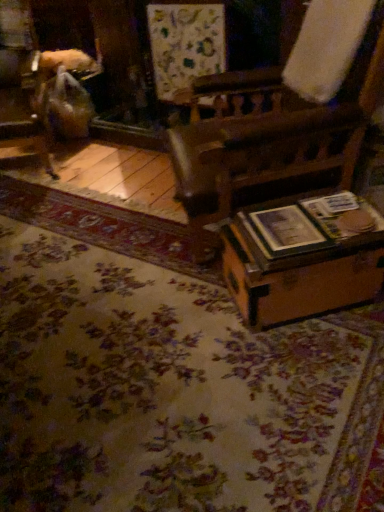
Where is `floral carpet at center`? This screenshot has width=384, height=512. floral carpet at center is located at coordinates (166, 376).

The height and width of the screenshot is (512, 384). What do you see at coordinates (303, 257) in the screenshot?
I see `wooden trunk at lower right` at bounding box center [303, 257].

Locate an element on the screen. This screenshot has height=512, width=384. floral carpet at center is located at coordinates (166, 376).

Based on the photo, measure the distance from wooden chair at left to floral carpet at center.

A distance of 4.87 feet exists between wooden chair at left and floral carpet at center.

Is wooden chair at left aimed at floral carpet at center?

Yes, wooden chair at left is facing floral carpet at center.

Would you say wooden chair at left is a long distance from floral carpet at center?

Absolutely, wooden chair at left is distant from floral carpet at center.

In the image, there is a wooden chair at left. Where is `mat below it (from a real-world perspective)`? Image resolution: width=384 pixels, height=512 pixels. mat below it (from a real-world perspective) is located at coordinates (166, 376).

Which object is wider, wooden chair at left or wooden trunk at lower right?

wooden chair at left.

From the picture: Which is farther, (37,136) or (239,280)?

The point (37,136) is farther.

Does wooden chair at left turn towards wooden trunk at lower right?

No, wooden chair at left is not aimed at wooden trunk at lower right.

Is wooden trunk at lower right positioned with its back to floral carpet at center?

wooden trunk at lower right does not have its back to floral carpet at center.

Is point (354, 237) closer to viewer compared to point (184, 295)?

Yes, point (354, 237) is closer to viewer.

From the image's perspective, is wooden trunk at lower right located above or below floral carpet at center?

Clearly, from the image's perspective, wooden trunk at lower right is above floral carpet at center.

Does wooden trunk at lower right touch floral carpet at center?

There is a gap between wooden trunk at lower right and floral carpet at center.

Looking at this image, from the image's perspective, does floral carpet at center appear lower than wooden chair at left?

Correct, floral carpet at center appears lower than wooden chair at left in the image.

Is floral carpet at center outside of wooden chair at left?

floral carpet at center is positioned outside wooden chair at left.

Considering the positions of objects floral carpet at center and wooden chair at left in the image provided, who is behind, floral carpet at center or wooden chair at left?

wooden chair at left is more distant.

Does floral carpet at center have a lesser height compared to wooden chair at left?

Correct, floral carpet at center is not as tall as wooden chair at left.

Considering their positions, is wooden trunk at lower right located in front of or behind wooden chair at left?

Visually, wooden trunk at lower right is located in front of wooden chair at left.

Is wooden trunk at lower right facing away from wooden chair at left?

No.

Considering the sizes of wooden trunk at lower right and wooden chair at left in the image, is wooden trunk at lower right wider or thinner than wooden chair at left?

wooden trunk at lower right is thinner than wooden chair at left.

From the image's perspective, is wooden trunk at lower right located above wooden chair at left?

No, from the image's perspective, wooden trunk at lower right is not over wooden chair at left.

Which of these two, floral carpet at center or wooden trunk at lower right, stands shorter?

floral carpet at center.

Locate an element on the screen. table above the floral carpet at center (from a real-world perspective) is located at coordinates (303, 257).

Between floral carpet at center and wooden trunk at lower right, which one has smaller width?

wooden trunk at lower right is thinner.

At what (x,y) coordinates should I click in order to perform the action: click on furniture above the floral carpet at center (from a real-world perspective). Please return your answer as a coordinate pair (x, y). The image size is (384, 512). Looking at the image, I should click on (22, 83).

The image size is (384, 512). I want to click on furniture that is on the left side of wooden trunk at lower right, so click(22, 83).

From the image, which object appears to be nearer to wooden chair at left, wooden trunk at lower right or floral carpet at center?

floral carpet at center.

Looking at this image, based on their spatial positions, is floral carpet at center or wooden chair at left closer to wooden trunk at lower right?

floral carpet at center is positioned closer to the anchor wooden trunk at lower right.

Which object lies nearer to the anchor point floral carpet at center, wooden chair at left or wooden trunk at lower right?

wooden trunk at lower right is positioned closer to the anchor floral carpet at center.

Looking at this image, which object lies further to the anchor point wooden trunk at lower right, wooden chair at left or floral carpet at center?

wooden chair at left.

When comparing their distances from floral carpet at center, does wooden trunk at lower right or wooden chair at left seem further?

wooden chair at left lies further to floral carpet at center than the other object.

From the image, which object appears to be nearer to wooden chair at left, floral carpet at center or wooden trunk at lower right?

floral carpet at center lies closer to wooden chair at left than the other object.

Find the location of a particular element. This screenshot has height=512, width=384. mat between wooden chair at left and wooden trunk at lower right from left to right is located at coordinates (166, 376).